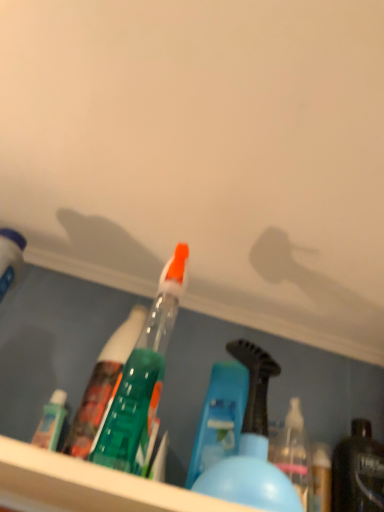
The image size is (384, 512). What do you see at coordinates (358, 471) in the screenshot?
I see `shiny black bottle at lower right, the first bottle in the right-to-left sequence` at bounding box center [358, 471].

Where is `matte white bottle at left, positioned as the 3th bottle in right-to-left order`? The image size is (384, 512). matte white bottle at left, positioned as the 3th bottle in right-to-left order is located at coordinates (10, 258).

You are a GUI agent. You are given a task and a screenshot of the screen. Output one action in this format:
    pyautogui.click(x=<x>, y=<y>)
    Task: Click on the blue plastic bottle at center, which is the second bottle in left-to-right order
    
    Given the screenshot: What is the action you would take?
    pyautogui.click(x=251, y=446)

Locate an element on the screen. The image size is (384, 512). shiny black bottle at lower right, the 3th bottle from the left is located at coordinates (358, 471).

From a real-world perspective, is shiny black bottle at lower right, the first bottle in the right-to-left sequence, physically above matte white bottle at left, the 1th bottle from the left?

No, from a real-world perspective, shiny black bottle at lower right, the first bottle in the right-to-left sequence, is not on top of matte white bottle at left, the 1th bottle from the left.

Is shiny black bottle at lower right, the 3th bottle from the left, to the left of matte white bottle at left, the 1th bottle from the left, from the viewer's perspective?

No.

Considering the relative sizes of shiny black bottle at lower right, the 3th bottle from the left, and matte white bottle at left, positioned as the 3th bottle in right-to-left order, in the image provided, is shiny black bottle at lower right, the 3th bottle from the left, smaller than matte white bottle at left, positioned as the 3th bottle in right-to-left order,?

Yes, shiny black bottle at lower right, the 3th bottle from the left, is smaller than matte white bottle at left, positioned as the 3th bottle in right-to-left order.

Is shiny black bottle at lower right, the 3th bottle from the left, further to camera compared to matte white bottle at left, the 1th bottle from the left?

Yes, it is.

Which is more to the left, matte white bottle at left, the 1th bottle from the left, or blue plastic bottle at center, the 2th bottle from the right?

Positioned to the left is matte white bottle at left, the 1th bottle from the left.

Which of these two, matte white bottle at left, positioned as the 3th bottle in right-to-left order, or blue plastic bottle at center, the 2th bottle from the right, is smaller?

matte white bottle at left, positioned as the 3th bottle in right-to-left order, is smaller.

Is matte white bottle at left, the 1th bottle from the left, positioned beyond the bounds of blue plastic bottle at center, the 2th bottle from the right?

Yes, matte white bottle at left, the 1th bottle from the left, is not within blue plastic bottle at center, the 2th bottle from the right.

How distant is matte white bottle at left, positioned as the 3th bottle in right-to-left order, from blue plastic bottle at center, the 2th bottle from the right?

They are 15.54 inches apart.

Is blue plastic bottle at center, the 2th bottle from the right, positioned with its back to matte white bottle at left, the 1th bottle from the left?

No, matte white bottle at left, the 1th bottle from the left, is not at the back of blue plastic bottle at center, the 2th bottle from the right.

From the image's perspective, is blue plastic bottle at center, the 2th bottle from the right, on top of matte white bottle at left, the 1th bottle from the left?

No, from the image's perspective, blue plastic bottle at center, the 2th bottle from the right, is not on top of matte white bottle at left, the 1th bottle from the left.

Between blue plastic bottle at center, which is the second bottle in left-to-right order, and matte white bottle at left, positioned as the 3th bottle in right-to-left order, which one has larger width?

With larger width is blue plastic bottle at center, which is the second bottle in left-to-right order.

Is blue plastic bottle at center, the 2th bottle from the right, facing towards shiny black bottle at lower right, the first bottle in the right-to-left sequence?

No, blue plastic bottle at center, the 2th bottle from the right, does not turn towards shiny black bottle at lower right, the first bottle in the right-to-left sequence.

Would you say blue plastic bottle at center, which is the second bottle in left-to-right order, is outside shiny black bottle at lower right, the first bottle in the right-to-left sequence?

Yes, blue plastic bottle at center, which is the second bottle in left-to-right order, is not within shiny black bottle at lower right, the first bottle in the right-to-left sequence.

Does point (291, 484) appear closer or farther from the camera than point (338, 461)?

Point (291, 484) is closer to the camera than point (338, 461).

From a real-world perspective, which object stands above the other?

In real-world perspective, shiny black bottle at lower right, the 3th bottle from the left, is above.

Does point (335, 476) lie in front of point (206, 485)?

No, (335, 476) is further to viewer.

At what (x,y) coordinates should I click in order to perform the action: click on bottle below the shiny black bottle at lower right, the 3th bottle from the left (from a real-world perspective). Please return your answer as a coordinate pair (x, y). This screenshot has width=384, height=512. Looking at the image, I should click on (251, 446).

Considering the positions of objects shiny black bottle at lower right, the 3th bottle from the left, and blue plastic bottle at center, which is the second bottle in left-to-right order, in the image provided, who is more to the right, shiny black bottle at lower right, the 3th bottle from the left, or blue plastic bottle at center, which is the second bottle in left-to-right order,?

shiny black bottle at lower right, the 3th bottle from the left.

Is matte white bottle at left, the 1th bottle from the left, oriented away from shiny black bottle at lower right, the first bottle in the right-to-left sequence?

That's not correct — matte white bottle at left, the 1th bottle from the left, is not looking away from shiny black bottle at lower right, the first bottle in the right-to-left sequence.

Is matte white bottle at left, positioned as the 3th bottle in right-to-left order, smaller than shiny black bottle at lower right, the first bottle in the right-to-left sequence?

No.

From a real-world perspective, between matte white bottle at left, positioned as the 3th bottle in right-to-left order, and shiny black bottle at lower right, the 3th bottle from the left, who is vertically lower?

shiny black bottle at lower right, the 3th bottle from the left, from a real-world perspective.

Consider the image. Considering the positions of objects matte white bottle at left, positioned as the 3th bottle in right-to-left order, and shiny black bottle at lower right, the 3th bottle from the left, in the image provided, who is in front, matte white bottle at left, positioned as the 3th bottle in right-to-left order, or shiny black bottle at lower right, the 3th bottle from the left,?

matte white bottle at left, positioned as the 3th bottle in right-to-left order.

At what (x,y) coordinates should I click in order to perform the action: click on bottle above the shiny black bottle at lower right, the first bottle in the right-to-left sequence (from a real-world perspective). Please return your answer as a coordinate pair (x, y). Image resolution: width=384 pixels, height=512 pixels. Looking at the image, I should click on [10, 258].

Where is `the 1st bottle behind the blue plastic bottle at center, the 2th bottle from the right`? the 1st bottle behind the blue plastic bottle at center, the 2th bottle from the right is located at coordinates (10, 258).

From the image, which object appears to be farther from matte white bottle at left, the 1th bottle from the left, blue plastic bottle at center, which is the second bottle in left-to-right order, or shiny black bottle at lower right, the first bottle in the right-to-left sequence?

shiny black bottle at lower right, the first bottle in the right-to-left sequence.

Which object lies nearer to the anchor point shiny black bottle at lower right, the first bottle in the right-to-left sequence, matte white bottle at left, the 1th bottle from the left, or blue plastic bottle at center, the 2th bottle from the right?

Among the two, blue plastic bottle at center, the 2th bottle from the right, is located nearer to shiny black bottle at lower right, the first bottle in the right-to-left sequence.

Looking at this image, when comparing their distances from shiny black bottle at lower right, the first bottle in the right-to-left sequence, does blue plastic bottle at center, the 2th bottle from the right, or matte white bottle at left, positioned as the 3th bottle in right-to-left order, seem closer?

blue plastic bottle at center, the 2th bottle from the right, lies closer to shiny black bottle at lower right, the first bottle in the right-to-left sequence, than the other object.

When comparing their distances from matte white bottle at left, positioned as the 3th bottle in right-to-left order, does shiny black bottle at lower right, the 3th bottle from the left, or blue plastic bottle at center, which is the second bottle in left-to-right order, seem closer?

The object closer to matte white bottle at left, positioned as the 3th bottle in right-to-left order, is blue plastic bottle at center, which is the second bottle in left-to-right order.

Looking at the image, which one is located closer to blue plastic bottle at center, which is the second bottle in left-to-right order, shiny black bottle at lower right, the first bottle in the right-to-left sequence, or matte white bottle at left, the 1th bottle from the left?

shiny black bottle at lower right, the first bottle in the right-to-left sequence, lies closer to blue plastic bottle at center, which is the second bottle in left-to-right order, than the other object.

When comparing their distances from blue plastic bottle at center, which is the second bottle in left-to-right order, does matte white bottle at left, positioned as the 3th bottle in right-to-left order, or shiny black bottle at lower right, the 3th bottle from the left, seem further?

Among the two, matte white bottle at left, positioned as the 3th bottle in right-to-left order, is located further to blue plastic bottle at center, which is the second bottle in left-to-right order.

Identify the location of bottle situated between matte white bottle at left, positioned as the 3th bottle in right-to-left order, and shiny black bottle at lower right, the 3th bottle from the left, from left to right. (251, 446).